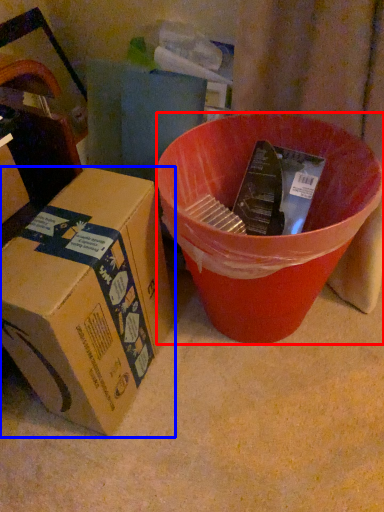
Question: Which of the following is the closest to the observer, bucket (highlighted by a red box) or box (highlighted by a blue box)?

Choices:
 (A) bucket
 (B) box

Answer: (B)